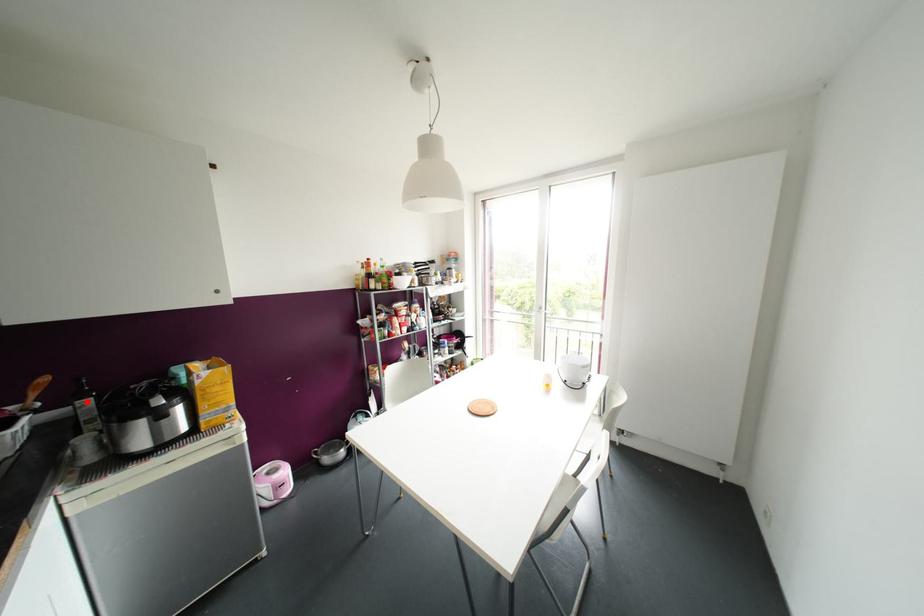
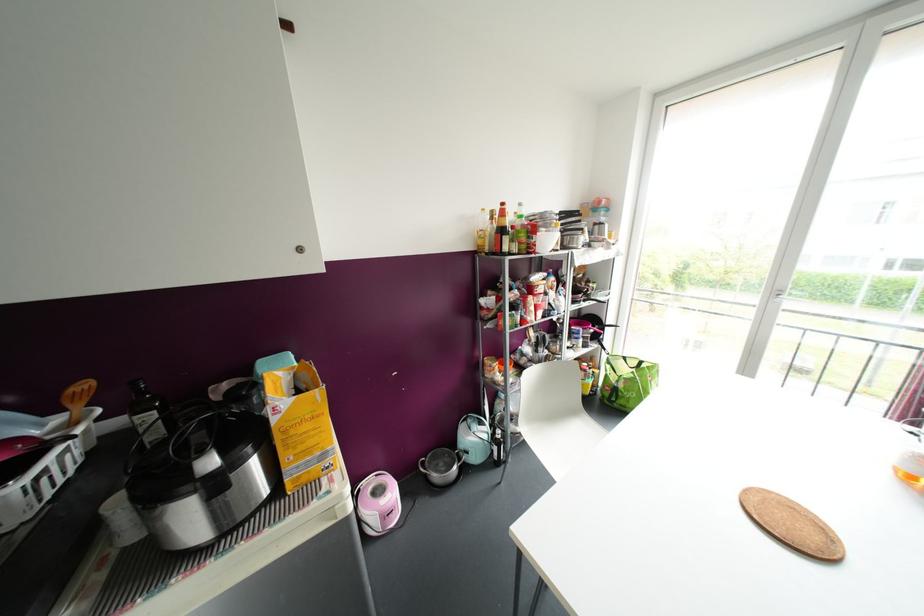
In the second image, find the point that corresponds to the highlighted location in the first image.

(150, 416)